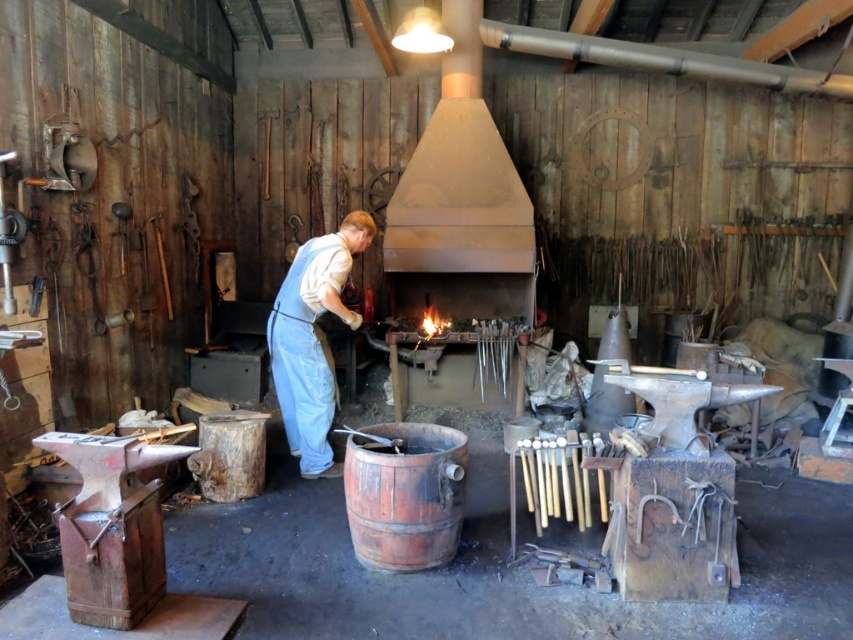
Question: Is the position of rustic wooden barrel at center less distant than that of denim overalls at center?

Choices:
 (A) yes
 (B) no

Answer: (A)

Question: Observing the image, what is the correct spatial positioning of rustic wooden barrel at center in reference to denim overalls at center?

Choices:
 (A) right
 (B) left

Answer: (A)

Question: Which of the following is the farthest from the observer?

Choices:
 (A) rustic wooden barrel at center
 (B) denim overalls at center

Answer: (B)

Question: In this image, where is rustic wooden barrel at center located relative to denim overalls at center?

Choices:
 (A) left
 (B) right

Answer: (B)

Question: Which point is farther to the camera?

Choices:
 (A) (395, 548)
 (B) (300, 429)

Answer: (B)

Question: Which point is closer to the camera taking this photo?

Choices:
 (A) (374, 465)
 (B) (283, 332)

Answer: (A)